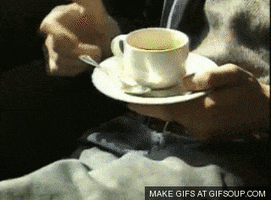
What are the coordinates of `space in center of coffee cup handle` in the screenshot? It's located at (121, 46).